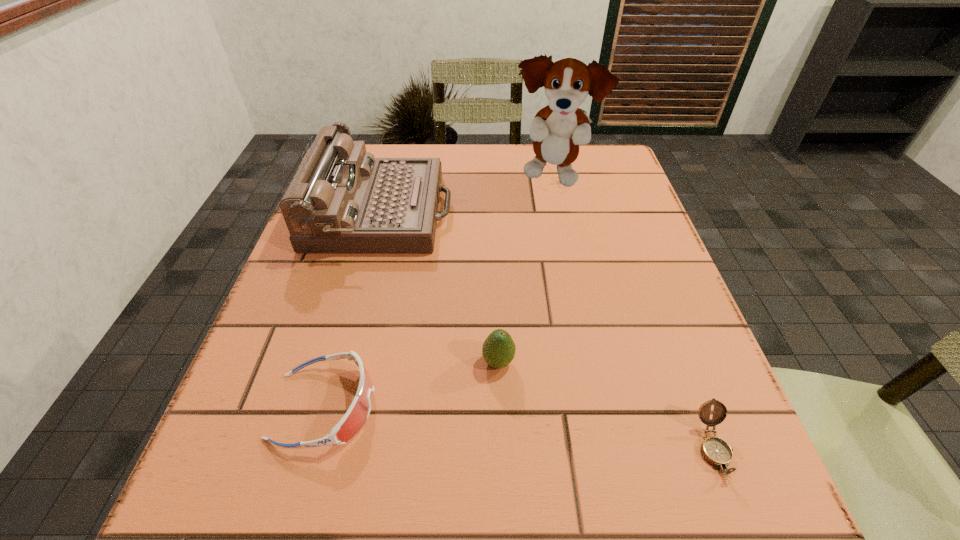
This screenshot has height=540, width=960. I want to click on object at the far right corner, so click(557, 130).

This screenshot has height=540, width=960. I want to click on object present at the near right corner, so click(716, 451).

Locate an element on the screen. The height and width of the screenshot is (540, 960). vacant space at the far edge of the desktop is located at coordinates (430, 148).

What are the coordinates of `blank space at the left edge of the desktop` in the screenshot? It's located at (x=276, y=304).

In the image, there is a desktop. Find the location of `vacant space at the right edge`. vacant space at the right edge is located at coordinates (662, 248).

What are the coordinates of `vacant position at the near left corner of the desktop` in the screenshot? It's located at (284, 516).

Find the location of a particular element. This screenshot has width=960, height=540. free space at the far right corner of the desktop is located at coordinates (632, 186).

Where is `vacant space that is in between the fourth object from left to right and the typewriter`? The height and width of the screenshot is (540, 960). vacant space that is in between the fourth object from left to right and the typewriter is located at coordinates coord(468,194).

You are a GUI agent. You are given a task and a screenshot of the screen. Output one action in this format:
    pyautogui.click(x=<x>, y=<y>)
    Task: Click on the free space between the fourth tallest object and the fourth shortest object
    The height and width of the screenshot is (540, 960).
    Given the screenshot: What is the action you would take?
    pyautogui.click(x=353, y=309)

At what (x,y) coordinates should I click in order to perform the action: click on vacant region between the avocado and the second object from right to left. Please return your answer as a coordinate pair (x, y). Looking at the image, I should click on (525, 269).